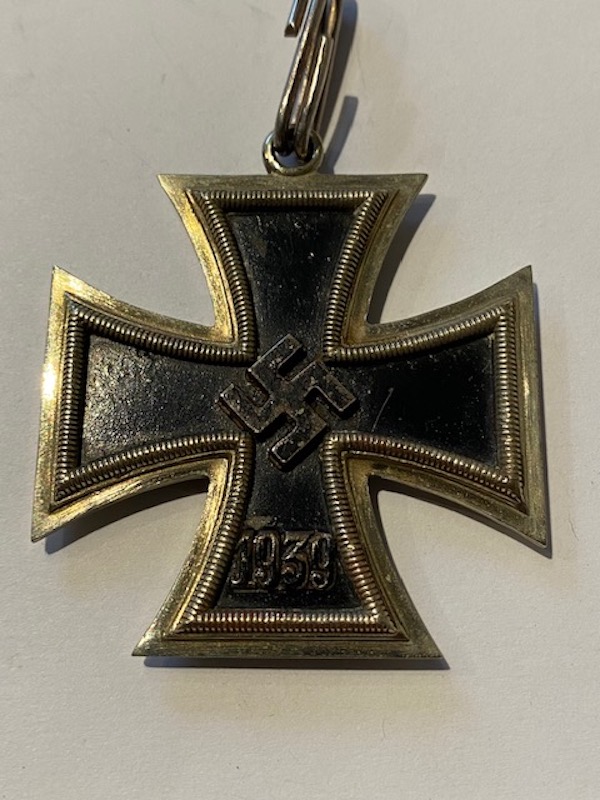
Find the location of a particular element. The height and width of the screenshot is (800, 600). hook is located at coordinates (307, 41).